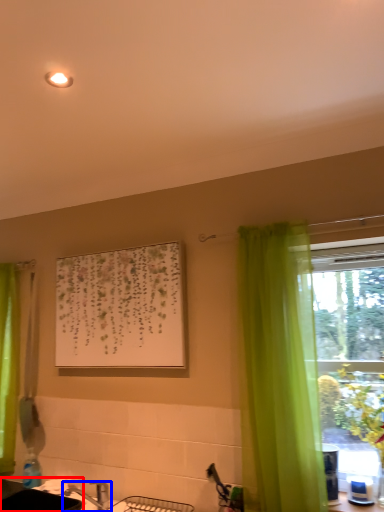
Question: Among these objects, which one is farthest to the camera, sink (highlighted by a red box) or tap (highlighted by a blue box)?

Choices:
 (A) sink
 (B) tap

Answer: (B)